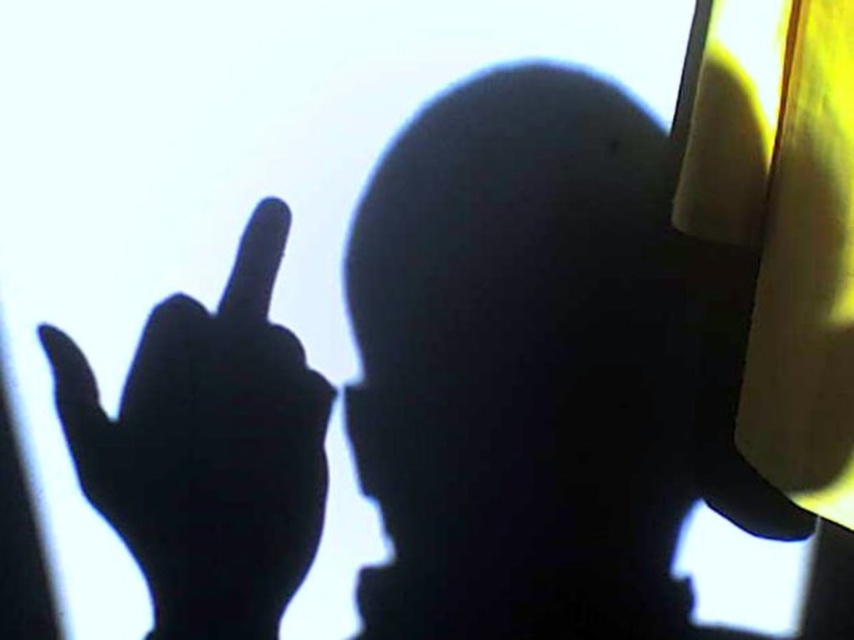
You are a delivery robot that needs to navigate through a narrow corridor. The corridor has a smooth yellow helmet at center and a black matte hand at upper left. Which object is taller and must be considered for clearance?

The smooth yellow helmet at center is taller than the black matte hand at upper left, so it must be considered for clearance.

You are a delivery robot with a height of 1.5 meters. You need to pass through a doorway that is 1.8 meters tall. The smooth yellow helmet at center is placed on the floor in front of you. Can you safely move forward without hitting your head on the doorway?

The smooth yellow helmet at center is 1.01 meters away from the camera. Since the robot is 1.5 meters tall and the doorway is 1.8 meters tall, there is a difference of 0.3 meters between the robot and the doorway height. This suggests there is enough clearance for the robot to pass safely without hitting its head. The distance to the helmet does not affect the height clearance, so the robot can move forward safely.

What is the exact coordinate position of the smooth yellow helmet at center in the image?

The smooth yellow helmet at center is located at point (539, 371).